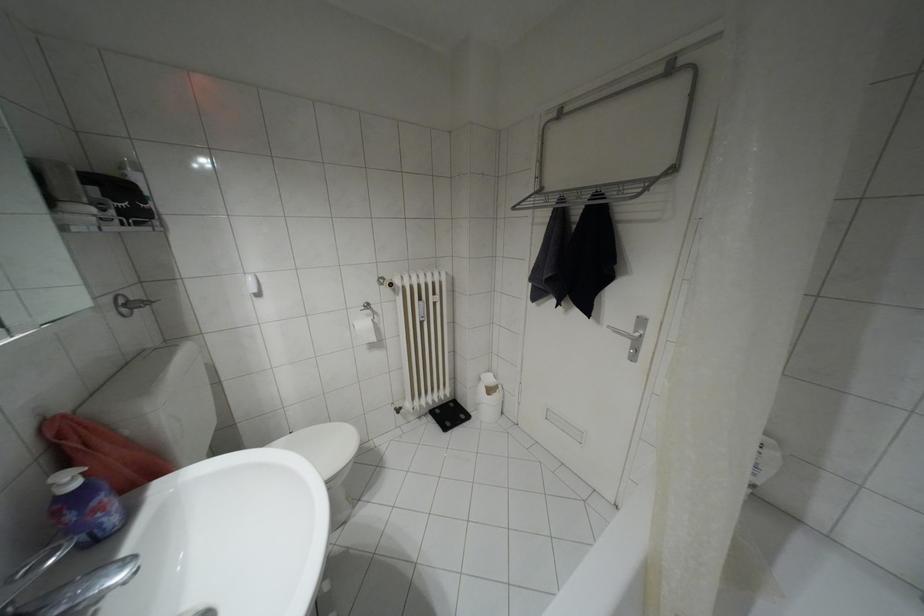
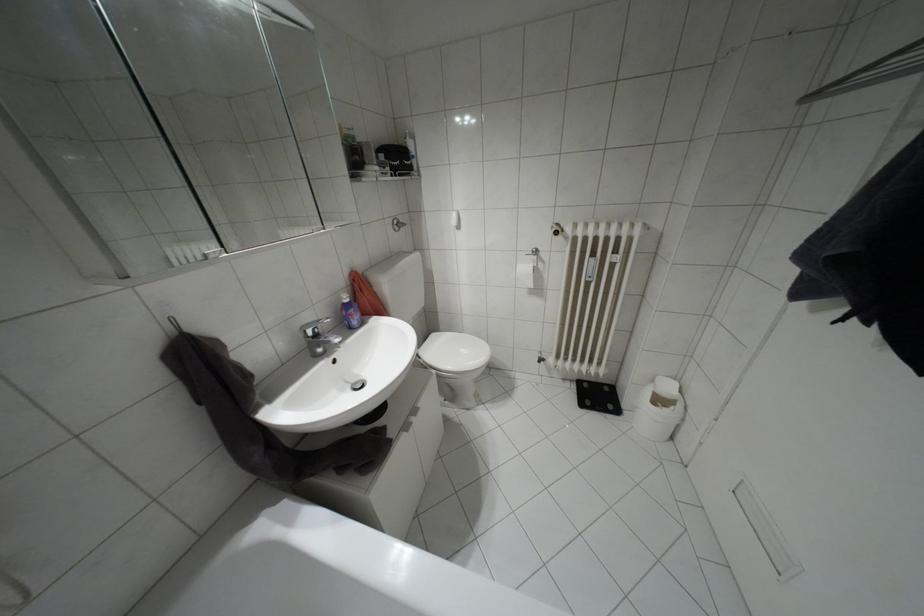
Locate, in the second image, the point that corresponds to [444,428] in the first image.

(580, 405)